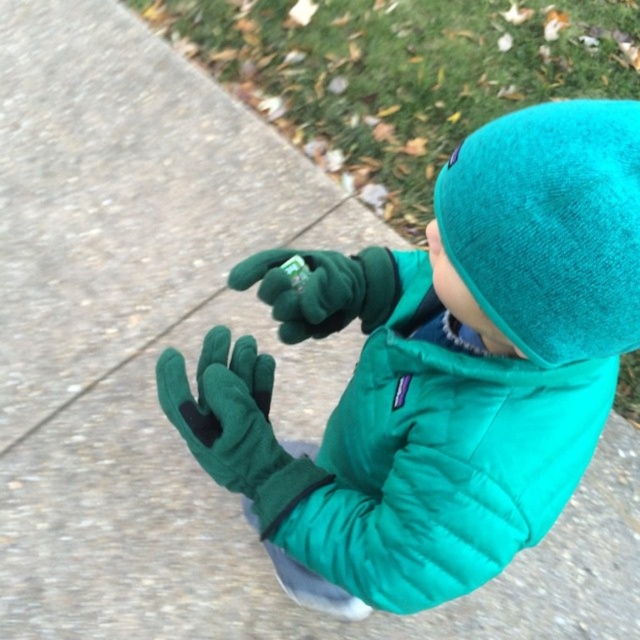
Can you confirm if green fleece gloves at center is wider than green fleece glove at center?

Correct, the width of green fleece gloves at center exceeds that of green fleece glove at center.

Who is more forward, (579,291) or (221,417)?

Point (579,291) is in front.

Find the location of a particular element. The image size is (640, 640). green fleece gloves at center is located at coordinates [x=442, y=364].

Locate an element on the screen. Image resolution: width=640 pixels, height=640 pixels. green fleece gloves at center is located at coordinates (442, 364).

How distant is green fleece glove at center from green fuzzy glove at center?

The distance of green fleece glove at center from green fuzzy glove at center is 6.22 inches.

Is green fleece glove at center to the left of green fuzzy glove at center from the viewer's perspective?

Yes, green fleece glove at center is to the left of green fuzzy glove at center.

Is point (204, 376) positioned after point (284, 257)?

That is False.

The image size is (640, 640). I want to click on green fleece glove at center, so click(x=225, y=410).

Who is shorter, green fleece gloves at center or teal fleece hat at upper right?

teal fleece hat at upper right

Does green fleece gloves at center have a larger size compared to teal fleece hat at upper right?

Yes.

Find the location of a particular element. The image size is (640, 640). green fleece gloves at center is located at coordinates (442, 364).

At what (x,y) coordinates should I click in order to perform the action: click on green fleece gloves at center. Please return your answer as a coordinate pair (x, y). Looking at the image, I should click on (442, 364).